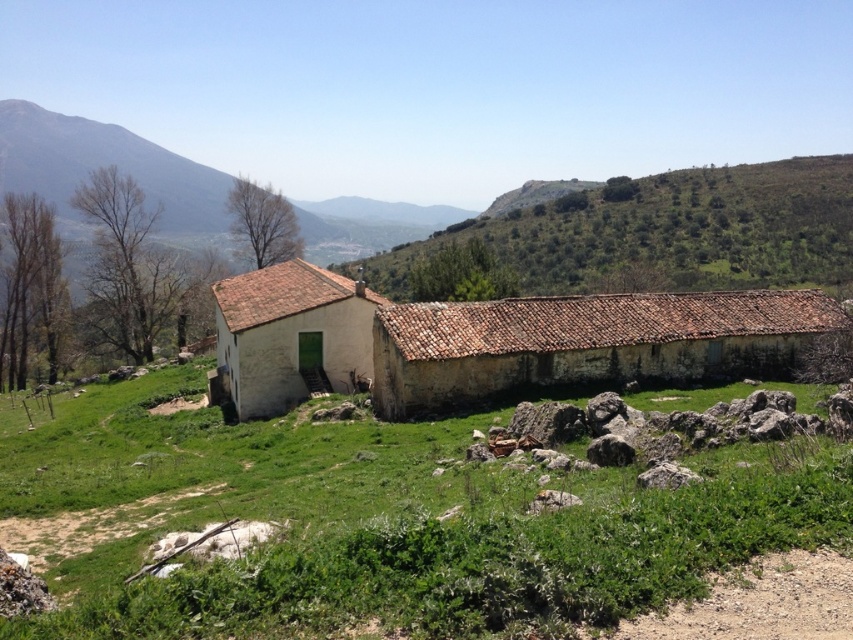
Question: Which of these objects is positioned closest to the white matte house at center?

Choices:
 (A) white clay barn at center
 (B) green grassy at center

Answer: (A)

Question: Is white clay barn at center closer to camera compared to white matte house at center?

Choices:
 (A) no
 (B) yes

Answer: (B)

Question: Does green grassy at center have a larger size compared to white clay barn at center?

Choices:
 (A) yes
 (B) no

Answer: (B)

Question: Estimate the real-world distances between objects in this image. Which object is closer to the green grassy at center?

Choices:
 (A) white clay barn at center
 (B) white matte house at center

Answer: (A)

Question: Which object appears farthest from the camera in this image?

Choices:
 (A) white matte house at center
 (B) white clay barn at center

Answer: (A)

Question: Does green grassy at center have a greater width compared to white clay barn at center?

Choices:
 (A) no
 (B) yes

Answer: (A)